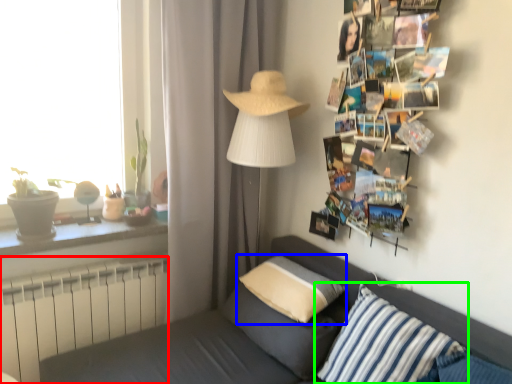
Question: Estimate the real-world distances between objects in this image. Which object is farther from radiator (highlighted by a red box), pillow (highlighted by a blue box) or pillow (highlighted by a green box)?

Choices:
 (A) pillow
 (B) pillow

Answer: (B)